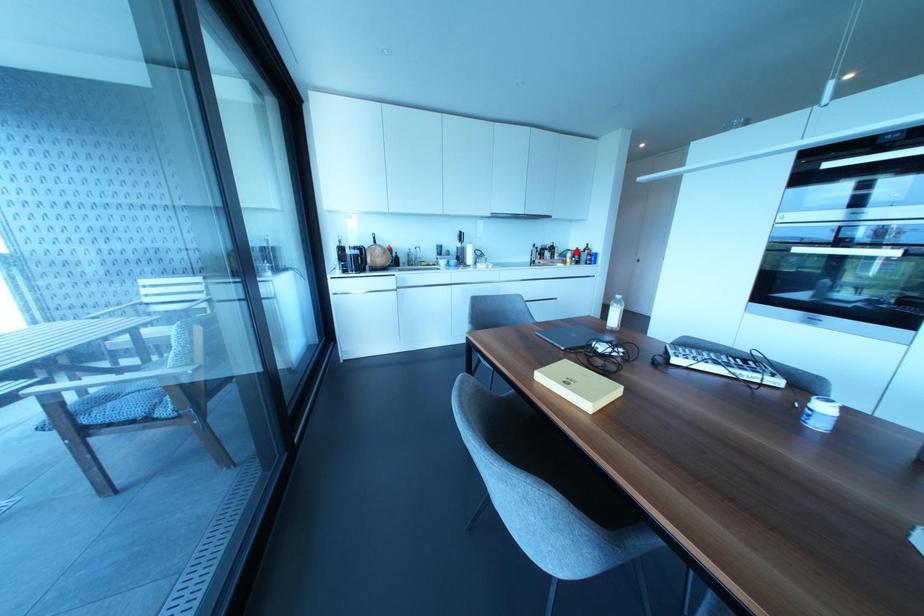
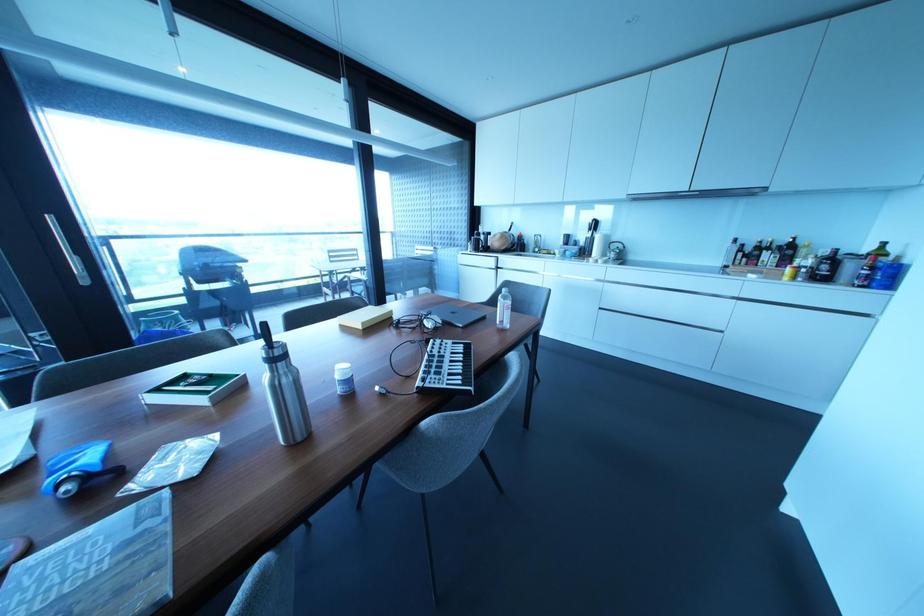
Question: A red point is marked in image1. In image2, is the corresponding 3D point closer to the camera or farther? Reply with the corresponding letter.

Choices:
 (A) The corresponding 3D point is closer.
 (B) The corresponding 3D point is farther.

Answer: (B)